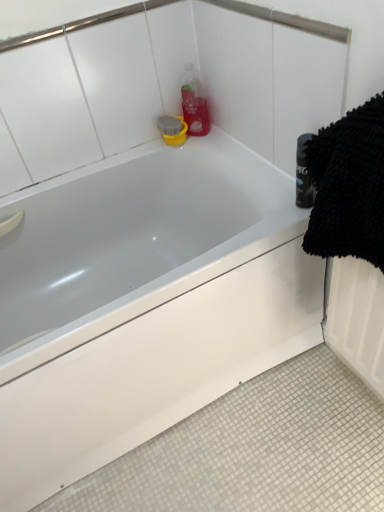
Question: Is point (187, 110) positioned closer to the camera than point (349, 207)?

Choices:
 (A) farther
 (B) closer

Answer: (A)

Question: From a real-world perspective, is translucent plastic bottle at upper center above or below black microfiber towel at right?

Choices:
 (A) above
 (B) below

Answer: (A)

Question: Which is nearer to the black microfiber towel at right?

Choices:
 (A) white glossy bathtub at upper center
 (B) translucent plastic bottle at upper center

Answer: (A)

Question: Considering the real-world distances, which object is farthest from the translucent plastic bottle at upper center?

Choices:
 (A) black microfiber towel at right
 (B) white glossy bathtub at upper center

Answer: (A)